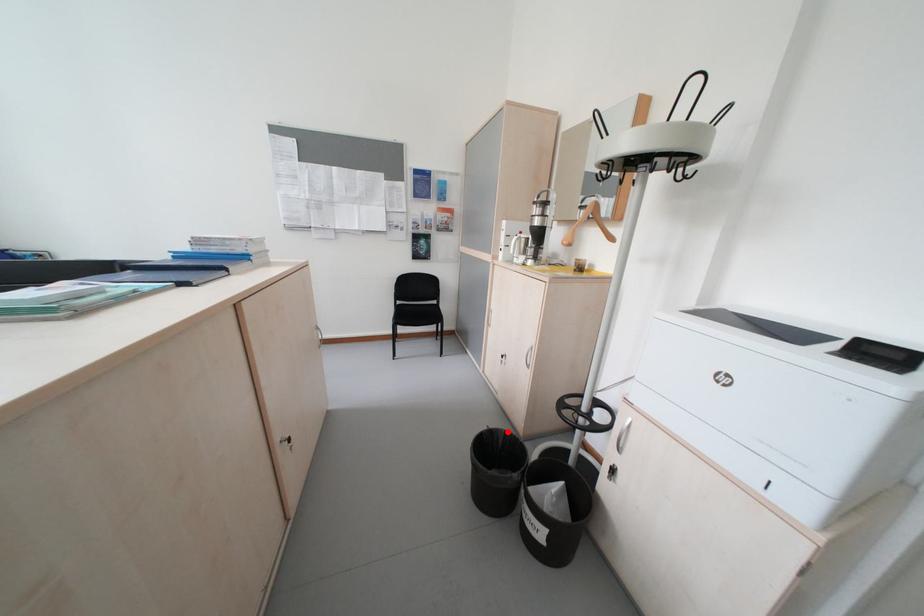
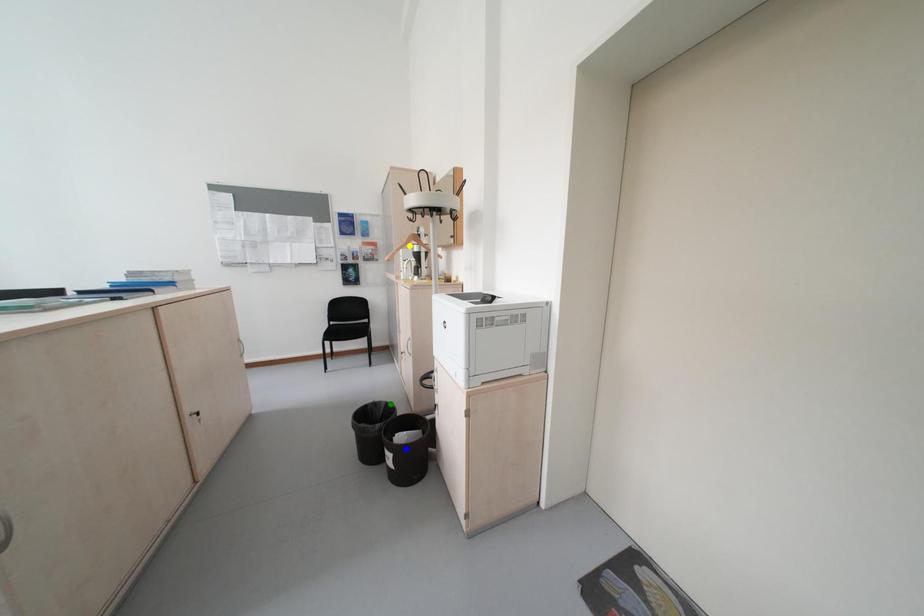
Question: I am providing you with two images of the same scene from different viewpoints. A red point is marked on the first image. You are given multiple points on the second image. Which mark in image 2 goes with the point in image 1?

Choices:
 (A) blue point
 (B) yellow point
 (C) green point

Answer: (C)